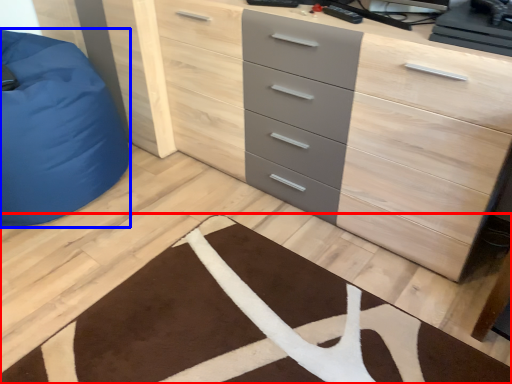
Question: Which object is closer to the camera taking this photo, doormat (highlighted by a red box) or furniture (highlighted by a blue box)?

Choices:
 (A) doormat
 (B) furniture

Answer: (A)